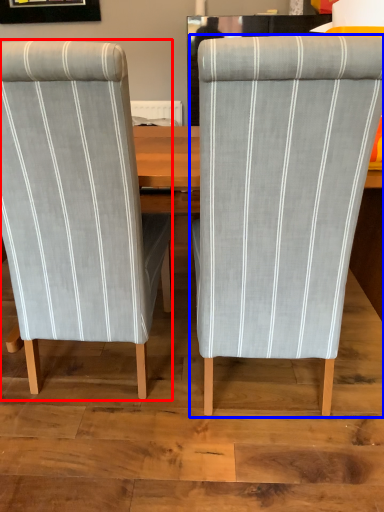
Question: Which of the following is the farthest to the observer, chair (highlighted by a red box) or chair (highlighted by a blue box)?

Choices:
 (A) chair
 (B) chair

Answer: (A)